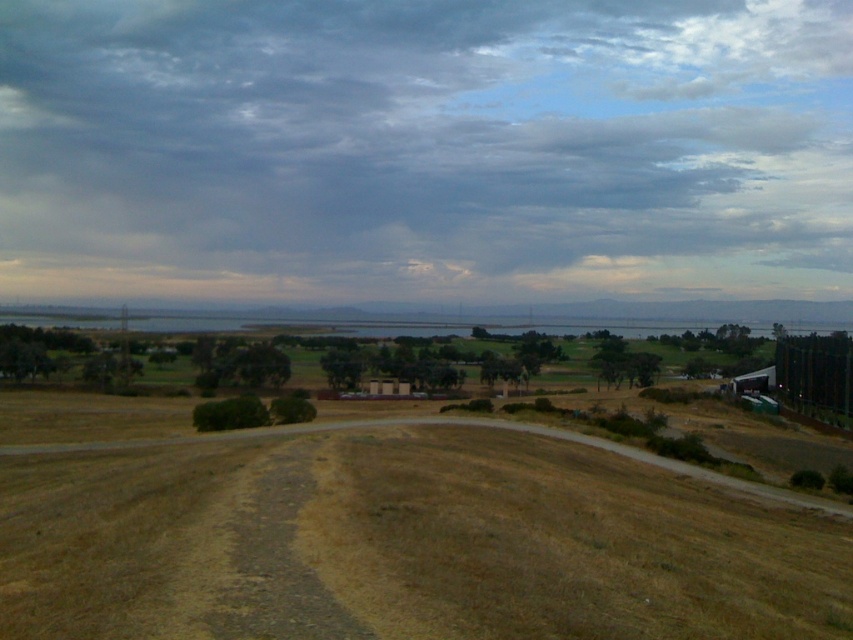
Who is shorter, cloudy sky at upper center or brown dry grass at lower center?

Standing shorter between the two is brown dry grass at lower center.

Who is taller, cloudy sky at upper center or brown dry grass at lower center?

cloudy sky at upper center

Which is behind, point (236, 100) or point (408, 604)?

The point (236, 100) is more distant.

Image resolution: width=853 pixels, height=640 pixels. In order to click on cloudy sky at upper center in this screenshot , I will do `click(425, 148)`.

Is brown dry grass at lower center smaller than smooth asphalt road at center?

Indeed, brown dry grass at lower center has a smaller size compared to smooth asphalt road at center.

Which is above, brown dry grass at lower center or smooth asphalt road at center?

Positioned higher is smooth asphalt road at center.

Based on the photo, who is more distant from viewer, (161, 522) or (105, 316)?

Positioned behind is point (105, 316).

Find the location of a particular element. The image size is (853, 640). brown dry grass at lower center is located at coordinates (404, 545).

At what (x,y) coordinates should I click in order to perform the action: click on cloudy sky at upper center. Please return your answer as a coordinate pair (x, y). The height and width of the screenshot is (640, 853). Looking at the image, I should click on (425, 148).

Between cloudy sky at upper center and smooth asphalt road at center, which one has less height?

smooth asphalt road at center

Who is more distant from viewer, (271, 237) or (822, 323)?

The point (822, 323) is behind.

The image size is (853, 640). Find the location of `cloudy sky at upper center`. cloudy sky at upper center is located at coordinates (425, 148).